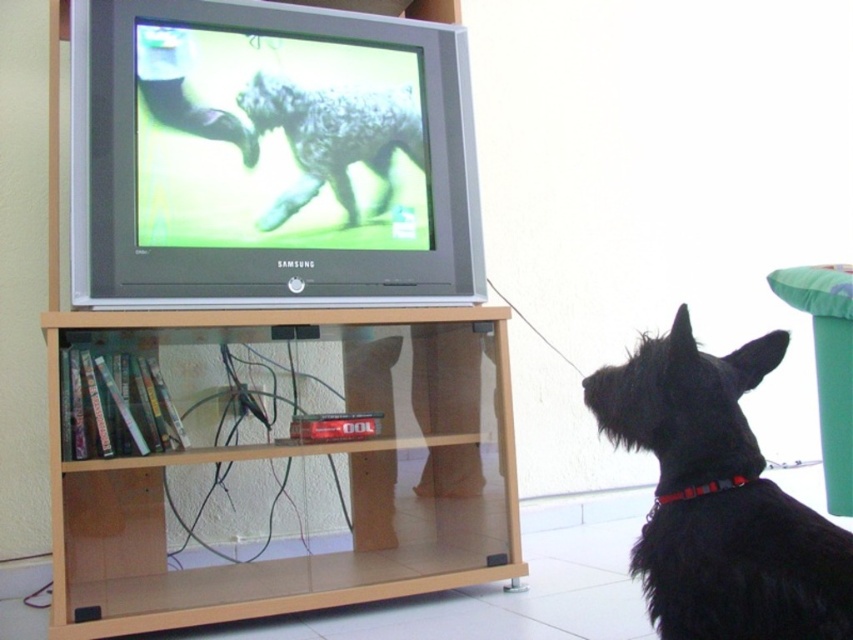
You are a photographer who wants to capture both the black fur dog at lower right and the fuzzy gray dog at center in the same frame. Based on their positions, which dog should you position closer to the left side of your camera viewfinder to include both?

To include both the black fur dog at lower right and the fuzzy gray dog at center in the same frame, you should position the fuzzy gray dog at center closer to the left side of your camera viewfinder since the black fur dog at lower right is already to the right of it.

You are a delivery person who just arrived at the house. You need to place a package on the transparent glass bookshelf at lower center and the black fur dog at lower right. However, you can only place the package on an object that is to the left of the dog. Which object can you use?

The transparent glass bookshelf at lower center is to the left of the black fur dog at lower right, so you can place the package on the transparent glass bookshelf at lower center.